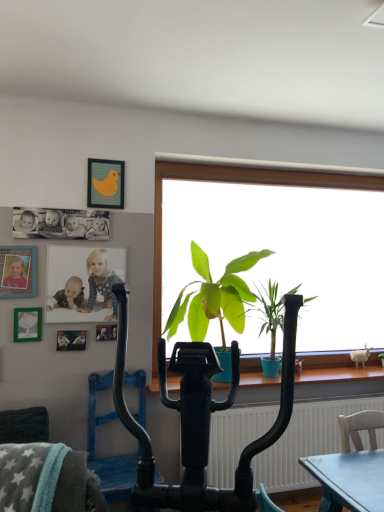
This screenshot has height=512, width=384. Find the location of `gray plush swivel chair at lower left`. gray plush swivel chair at lower left is located at coordinates (46, 479).

Find the location of a particular element. green matte plant at center, acting as the second houseplant starting from the right is located at coordinates (214, 301).

Measure the distance between green matte plant at center, the 2th houseplant from the left, and camera.

The distance of green matte plant at center, the 2th houseplant from the left, from camera is 10.40 feet.

Based on the photo, what is the approximate height of metallic silver photo frame at upper left, arranged as the first picture frame when ordered from the bottom?

metallic silver photo frame at upper left, arranged as the first picture frame when ordered from the bottom, is 5.45 inches tall.

Where is `matte white photo of children at upper left`? The height and width of the screenshot is (512, 384). matte white photo of children at upper left is located at coordinates (101, 282).

Identify the location of gray plush swivel chair at lower left. This screenshot has width=384, height=512. (46, 479).

Is black rubber vacuum at center completely or partially inside green matte plant at center, acting as the second houseplant starting from the right?

No, black rubber vacuum at center is located outside of green matte plant at center, acting as the second houseplant starting from the right.

Considering the positions of points (166, 324) and (145, 464), is point (166, 324) farther from camera compared to point (145, 464)?

Yes, point (166, 324) is behind point (145, 464).

From a real-world perspective, is green matte plant at center, acting as the second houseplant starting from the right, on black rubber vacuum at center?

Yes.

Locate an element on the screen. Image resolution: width=384 pixels, height=512 pixels. vacuum below the green matte plant at center, which ranks as the first houseplant in left-to-right order (from a real-world perspective) is located at coordinates (201, 418).

Which of these two, green matte plant at center, which ranks as the first houseplant in left-to-right order, or metallic silver picture frame at left, the third picture frame positioned from the top, is smaller?

Smaller between the two is metallic silver picture frame at left, the third picture frame positioned from the top.

Is green matte plant at center, acting as the second houseplant starting from the right, facing towards metallic silver picture frame at left, which ranks as the 4th picture frame in right-to-left order?

No, green matte plant at center, acting as the second houseplant starting from the right, does not turn towards metallic silver picture frame at left, which ranks as the 4th picture frame in right-to-left order.

Locate an element on the screen. the 1st houseplant to the right of the metallic silver picture frame at left, the third picture frame positioned from the top, starting your count from the anchor is located at coordinates (214, 301).

Is point (188, 327) positioned behind point (33, 322)?

Yes, it is behind point (33, 322).

From a real-world perspective, which is physically below, gray plush swivel chair at lower left or green matte plant at center, which ranks as the first houseplant in left-to-right order?

gray plush swivel chair at lower left is physically lower.

Between point (32, 448) and point (226, 315), which one is positioned in front?

Positioned in front is point (32, 448).

Is gray plush swivel chair at lower left touching green matte plant at center, which ranks as the first houseplant in left-to-right order?

gray plush swivel chair at lower left and green matte plant at center, which ranks as the first houseplant in left-to-right order, are clearly separated.

The height and width of the screenshot is (512, 384). In order to click on houseplant that is the 1st one when counting backward from the gray plush swivel chair at lower left in this screenshot , I will do `click(214, 301)`.

Can you tell me how much matte yellow bird at upper center, which ranks as the first picture frame in top-to-bottom order, and black matte photograph at upper left differ in facing direction?

The angular difference between matte yellow bird at upper center, which ranks as the first picture frame in top-to-bottom order, and black matte photograph at upper left is 0.00284 degrees.

Between matte yellow bird at upper center, marked as the 4th picture frame in a left-to-right arrangement, and black matte photograph at upper left, which one appears on the left side from the viewer's perspective?

black matte photograph at upper left is more to the left.

Does matte yellow bird at upper center, which ranks as the first picture frame in top-to-bottom order, touch black matte photograph at upper left?

There is a gap between matte yellow bird at upper center, which ranks as the first picture frame in top-to-bottom order, and black matte photograph at upper left.

Is matte plastic picture frame at left, positioned as the 1th picture frame in left-to-right order, inside the boundaries of metallic silver photo frame at upper left, which ranks as the fourth picture frame in top-to-bottom order, or outside?

matte plastic picture frame at left, positioned as the 1th picture frame in left-to-right order, lies outside metallic silver photo frame at upper left, which ranks as the fourth picture frame in top-to-bottom order.

How many degrees apart are the facing directions of matte plastic picture frame at left, acting as the 4th picture frame starting from the bottom, and metallic silver photo frame at upper left, the fifth picture frame in the left-to-right sequence?

The angle between the facing direction of matte plastic picture frame at left, acting as the 4th picture frame starting from the bottom, and the facing direction of metallic silver photo frame at upper left, the fifth picture frame in the left-to-right sequence, is 0.0645 degrees.

Are matte plastic picture frame at left, which appears as the fifth picture frame when viewed from the right, and metallic silver photo frame at upper left, the first picture frame positioned from the right, far apart?

Actually, matte plastic picture frame at left, which appears as the fifth picture frame when viewed from the right, and metallic silver photo frame at upper left, the first picture frame positioned from the right, are a little close together.

Which object is positioned more to the right, matte plastic picture frame at left, the second picture frame in the top-to-bottom sequence, or metallic silver photo frame at upper left, the fifth picture frame in the left-to-right sequence?

From the viewer's perspective, metallic silver photo frame at upper left, the fifth picture frame in the left-to-right sequence, appears more on the right side.

Can you confirm if green matte plant at center, acting as the second houseplant starting from the right, is shorter than black matte photograph at upper left?

Incorrect, the height of green matte plant at center, acting as the second houseplant starting from the right, does not fall short of that of black matte photograph at upper left.

In the scene shown: Relative to black matte photograph at upper left, is green matte plant at center, acting as the second houseplant starting from the right, in front or behind?

In the image, green matte plant at center, acting as the second houseplant starting from the right, appears in front of black matte photograph at upper left.

From the image's perspective, is green matte plant at center, acting as the second houseplant starting from the right, located beneath black matte photograph at upper left?

Yes.

Identify the location of the 2nd picture frame in front when counting from the matte yellow bird at upper center, which appears as the fifth picture frame when ordered from the bottom. This screenshot has height=512, width=384. (x=71, y=340).

In terms of size, does metallic silver photo frame at upper left, which is counted as the 5th picture frame, starting from the top, appear bigger or smaller than matte yellow bird at upper center, marked as the 4th picture frame in a left-to-right arrangement?

Clearly, metallic silver photo frame at upper left, which is counted as the 5th picture frame, starting from the top, is smaller in size than matte yellow bird at upper center, marked as the 4th picture frame in a left-to-right arrangement.

In terms of height, does metallic silver photo frame at upper left, arranged as the first picture frame when ordered from the bottom, look taller or shorter compared to matte yellow bird at upper center, marked as the 4th picture frame in a left-to-right arrangement?

metallic silver photo frame at upper left, arranged as the first picture frame when ordered from the bottom, is shorter than matte yellow bird at upper center, marked as the 4th picture frame in a left-to-right arrangement.

Is metallic silver photo frame at upper left, arranged as the first picture frame when ordered from the bottom, thinner than matte yellow bird at upper center, which ranks as the first picture frame in top-to-bottom order?

Yes.

What are the coordinates of `vacuum on the left of green matte plant at center, acting as the second houseplant starting from the right` in the screenshot? It's located at (201, 418).

Locate an element on the screen. This screenshot has width=384, height=512. the 2nd houseplant positioned above the metallic silver picture frame at left, the 2th picture frame viewed from the left (from a real-world perspective) is located at coordinates (214, 301).

Based on the photo, from the image, which object appears to be nearer to matte plastic picture frame at left, which appears as the fifth picture frame when viewed from the right, black rubber vacuum at center or metallic silver photo frame at upper left, the fifth picture frame in the left-to-right sequence?

metallic silver photo frame at upper left, the fifth picture frame in the left-to-right sequence, is positioned closer to the anchor matte plastic picture frame at left, which appears as the fifth picture frame when viewed from the right.

From the image, which object appears to be farther from green matte plant at center, acting as the second houseplant starting from the right, green matte plant at center, the 2th houseplant from the left, or matte white photo of children at upper left?

matte white photo of children at upper left is positioned further to the anchor green matte plant at center, acting as the second houseplant starting from the right.

Estimate the real-world distances between objects in this image. Which object is closer to matte white photo of children at upper left, green matte plant at center, which ranks as the first houseplant in left-to-right order, or green matte plant at center, the 2th houseplant from the left?

Among the two, green matte plant at center, which ranks as the first houseplant in left-to-right order, is located nearer to matte white photo of children at upper left.

Which object lies further to the anchor point black matte photograph at upper left, metallic silver photo frame at upper left, which appears as the 3th picture frame when viewed from the right, or green matte plant at center, which ranks as the first houseplant in left-to-right order?

green matte plant at center, which ranks as the first houseplant in left-to-right order.

Based on their spatial positions, is matte plastic picture frame at left, the second picture frame in the top-to-bottom sequence, or gray plush swivel chair at lower left further from metallic silver photo frame at upper left, which ranks as the second picture frame in bottom-to-top order?

gray plush swivel chair at lower left.

Considering their positions, is matte plastic picture frame at left, acting as the 4th picture frame starting from the bottom, positioned closer to metallic silver photo frame at upper left, the fifth picture frame in the left-to-right sequence, than black matte photograph at upper left?

matte plastic picture frame at left, acting as the 4th picture frame starting from the bottom, lies closer to metallic silver photo frame at upper left, the fifth picture frame in the left-to-right sequence, than the other object.

Which object lies further to the anchor point matte plastic picture frame at left, the second picture frame in the top-to-bottom sequence, black rubber vacuum at center or metallic silver photo frame at upper left, the 3th picture frame when ordered from left to right?

Among the two, black rubber vacuum at center is located further to matte plastic picture frame at left, the second picture frame in the top-to-bottom sequence.

Estimate the real-world distances between objects in this image. Which object is closer to green matte plant at center, which is counted as the first houseplant, starting from the right, matte yellow bird at upper center, marked as the 4th picture frame in a left-to-right arrangement, or green matte plant at center, which ranks as the first houseplant in left-to-right order?

The object closer to green matte plant at center, which is counted as the first houseplant, starting from the right, is green matte plant at center, which ranks as the first houseplant in left-to-right order.

Where is `art between matte yellow bird at upper center, which appears as the fifth picture frame when ordered from the bottom, and matte white photo of children at upper left vertically`? art between matte yellow bird at upper center, which appears as the fifth picture frame when ordered from the bottom, and matte white photo of children at upper left vertically is located at coordinates (60, 224).

You are a GUI agent. You are given a task and a screenshot of the screen. Output one action in this format:
    pyautogui.click(x=<x>, y=<y>)
    Task: Click on the art positioned between gray plush swivel chair at lower left and matte white photo of children at upper left from near to far
    The height and width of the screenshot is (512, 384).
    Given the screenshot: What is the action you would take?
    click(x=60, y=224)

Identify the location of vacuum located between gray plush swivel chair at lower left and matte plastic picture frame at left, positioned as the 1th picture frame in left-to-right order, in the depth direction. The height and width of the screenshot is (512, 384). (201, 418).

This screenshot has height=512, width=384. What are the coordinates of `art between black rubber vacuum at center and matte yellow bird at upper center, marked as the 4th picture frame in a left-to-right arrangement, along the z-axis` in the screenshot? It's located at [x=60, y=224].